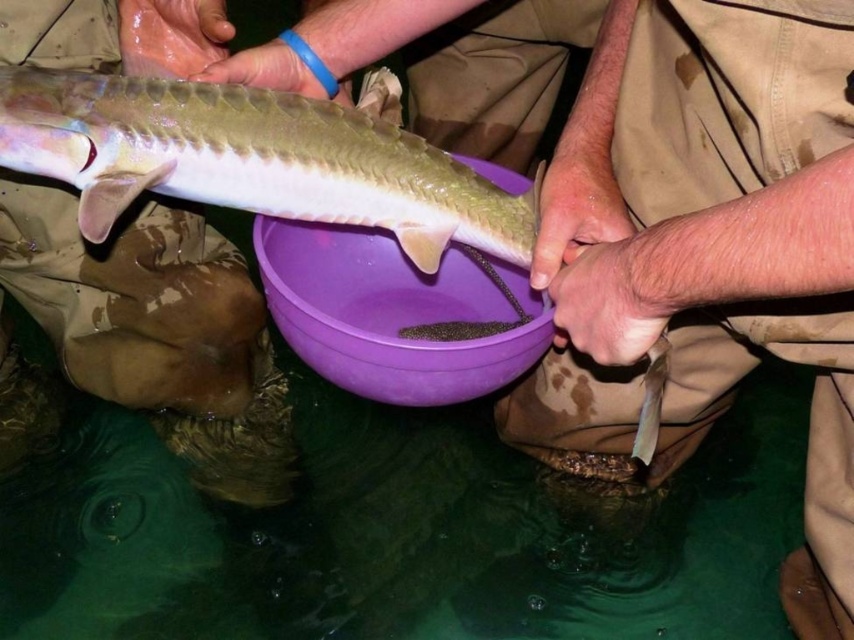
You are a photographer trying to capture a close shot of the shiny silver fish at center without accidentally including the smooth beige pants at upper left in the frame. Given their relative sizes, will the pants be easier to hide behind the fish?

The smooth beige pants at upper left is thinner than the shiny silver fish at center, so yes, the pants will be easier to hide behind the fish since they are narrower.

You are a photographer trying to capture a clear photo of the shiny silver fish at center. However, the smooth beige pants at upper left are blocking your view. Can you move the pants to the side to get a better shot?

The shiny silver fish at center is behind the smooth beige pants at upper left, so moving the smooth beige pants at upper left to the side would allow you to see the shiny silver fish at center clearly.

You are a photographer trying to capture a close shot of the sturgeon in the purple basin. You notice two points marked on the fish, point at point (75, 310) and point at point (165, 168). Which point is closer to your camera lens?

Point at point (75, 310) is closer to the camera lens than point at point (165, 168).